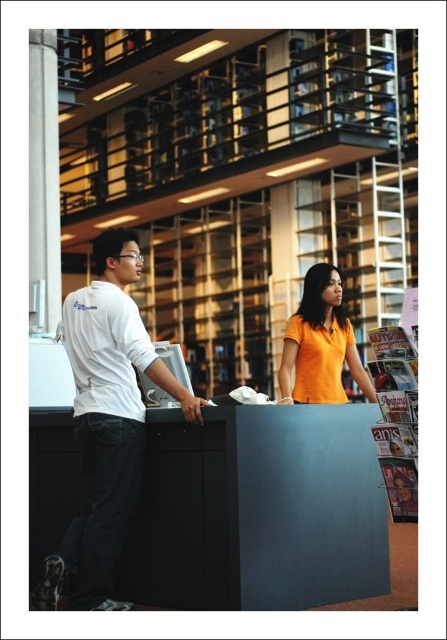
Question: Does matte black desk at center appear under orange matte shirt at center?

Choices:
 (A) yes
 (B) no

Answer: (A)

Question: Does matte black desk at center appear under white matte shirt at left?

Choices:
 (A) yes
 (B) no

Answer: (A)

Question: Which point appears closest to the camera in this image?

Choices:
 (A) (338, 307)
 (B) (307, 557)
 (C) (118, 541)

Answer: (C)

Question: Among these objects, which one is farthest from the camera?

Choices:
 (A) matte black desk at center
 (B) white matte shirt at left
 (C) orange matte shirt at center

Answer: (C)

Question: Which is nearer to the white matte shirt at left?

Choices:
 (A) orange matte shirt at center
 (B) matte black desk at center

Answer: (B)

Question: Considering the relative positions of matte black desk at center and orange matte shirt at center in the image provided, where is matte black desk at center located with respect to orange matte shirt at center?

Choices:
 (A) right
 (B) left

Answer: (B)